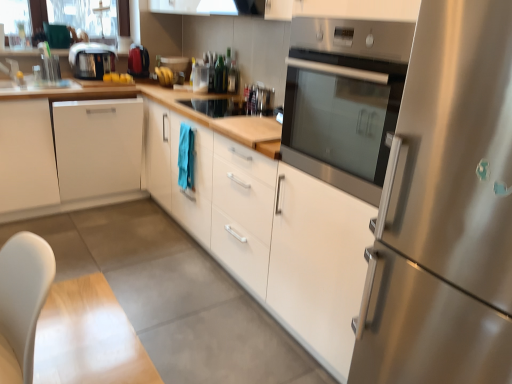
This screenshot has height=384, width=512. I want to click on vacant space situated above brushed metal faucet at upper left (from a real-world perspective), so click(x=10, y=56).